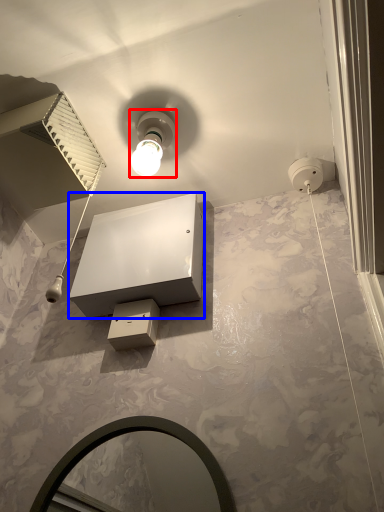
Question: Which object is further to the camera taking this photo, light fixture (highlighted by a red box) or vanity (highlighted by a blue box)?

Choices:
 (A) light fixture
 (B) vanity

Answer: (A)